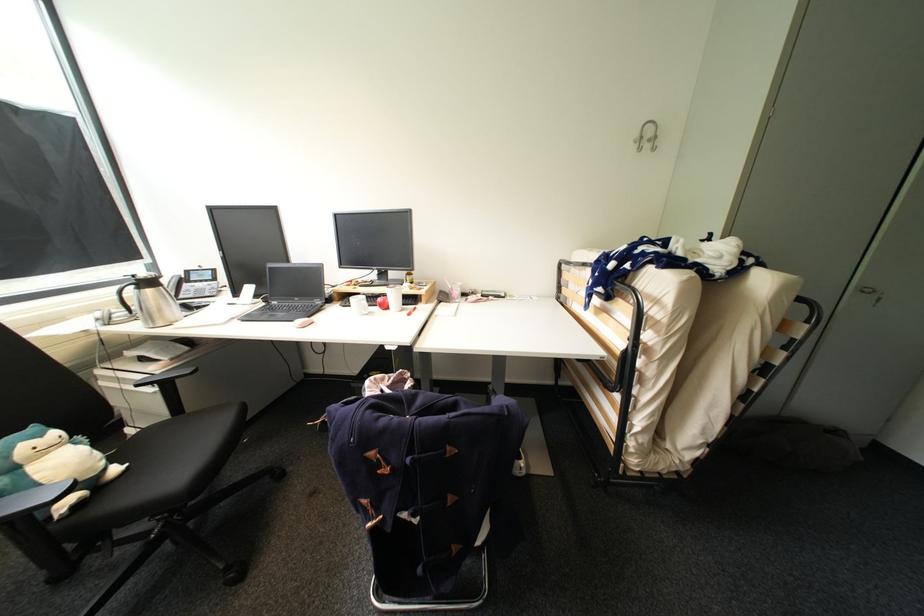
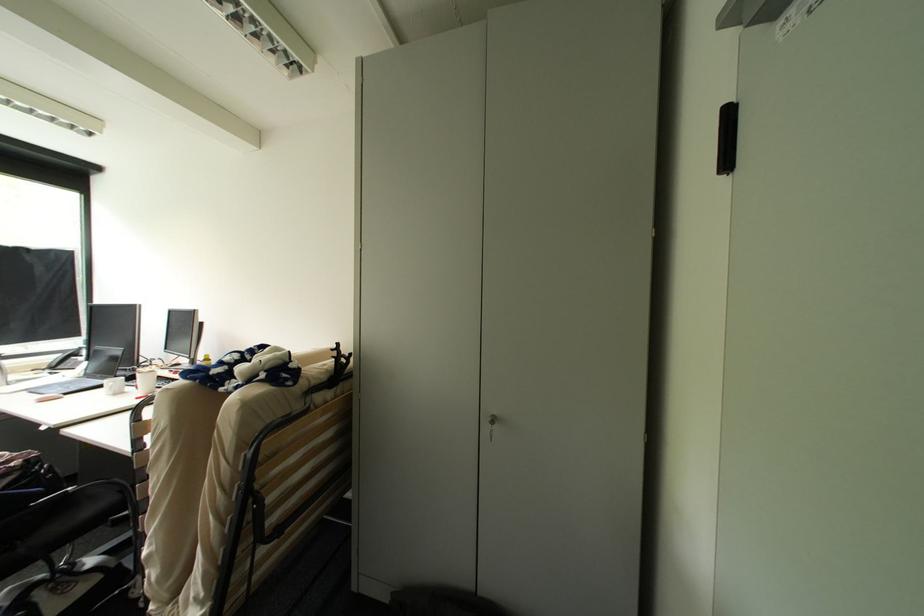
Question: The images are taken continuously from a first-person perspective. In which direction are you moving?

Choices:
 (A) Left
 (B) Right
 (C) Forward
 (D) Backward

Answer: (B)